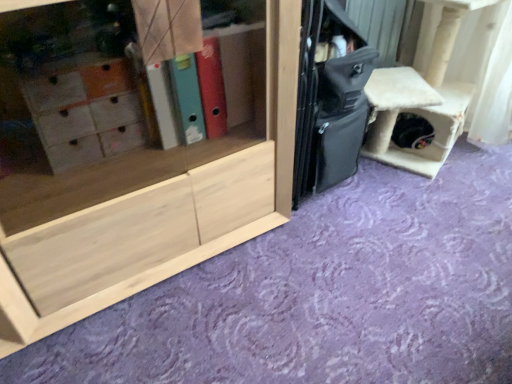
Question: Is white fluffy cat house at right wider than natural wood cabinet at center?

Choices:
 (A) yes
 (B) no

Answer: (B)

Question: Is white fluffy cat house at right further to camera compared to natural wood cabinet at center?

Choices:
 (A) no
 (B) yes

Answer: (B)

Question: Is natural wood cabinet at center inside white fluffy cat house at right?

Choices:
 (A) yes
 (B) no

Answer: (B)

Question: Considering the relative positions of white fluffy cat house at right and natural wood cabinet at center in the image provided, is white fluffy cat house at right to the right of natural wood cabinet at center from the viewer's perspective?

Choices:
 (A) no
 (B) yes

Answer: (B)

Question: Is white fluffy cat house at right not near natural wood cabinet at center?

Choices:
 (A) no
 (B) yes

Answer: (A)

Question: Is point (80, 286) positioned closer to the camera than point (509, 89)?

Choices:
 (A) farther
 (B) closer

Answer: (B)

Question: Is natural wood cabinet at center wider or thinner than white fluffy cat house at right?

Choices:
 (A) wide
 (B) thin

Answer: (A)

Question: In the image, is natural wood cabinet at center on the left side or the right side of white fluffy cat house at right?

Choices:
 (A) right
 (B) left

Answer: (B)

Question: In terms of height, does natural wood cabinet at center look taller or shorter compared to white fluffy cat house at right?

Choices:
 (A) tall
 (B) short

Answer: (A)

Question: Looking at their shapes, would you say black matte suitcase at center is wider or thinner than white fluffy cat house at right?

Choices:
 (A) wide
 (B) thin

Answer: (B)

Question: In the image, is black matte suitcase at center positioned in front of or behind white fluffy cat house at right?

Choices:
 (A) behind
 (B) front

Answer: (B)

Question: In the image, is black matte suitcase at center on the left side or the right side of white fluffy cat house at right?

Choices:
 (A) left
 (B) right

Answer: (A)

Question: Considering the positions of black matte suitcase at center and white fluffy cat house at right in the image, is black matte suitcase at center bigger or smaller than white fluffy cat house at right?

Choices:
 (A) big
 (B) small

Answer: (B)

Question: Is black matte suitcase at center situated inside natural wood cabinet at center or outside?

Choices:
 (A) outside
 (B) inside

Answer: (A)

Question: Would you say black matte suitcase at center is to the left or to the right of natural wood cabinet at center in the picture?

Choices:
 (A) left
 (B) right

Answer: (B)